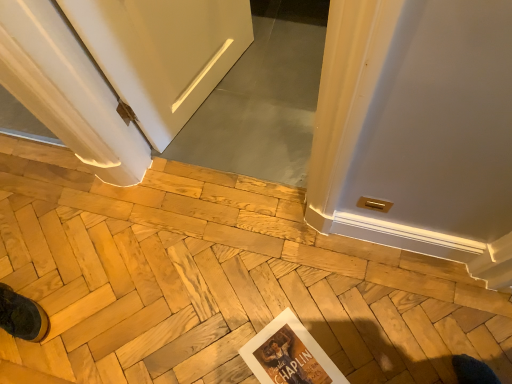
This screenshot has height=384, width=512. Describe the element at coordinates (22, 316) in the screenshot. I see `dark brown leather boot at lower left` at that location.

At what (x,y) coordinates should I click in order to perform the action: click on dark brown leather boot at lower left. Please return your answer as a coordinate pair (x, y). Looking at the image, I should click on (22, 316).

Identify the location of dark brown leather boot at lower left. (22, 316).